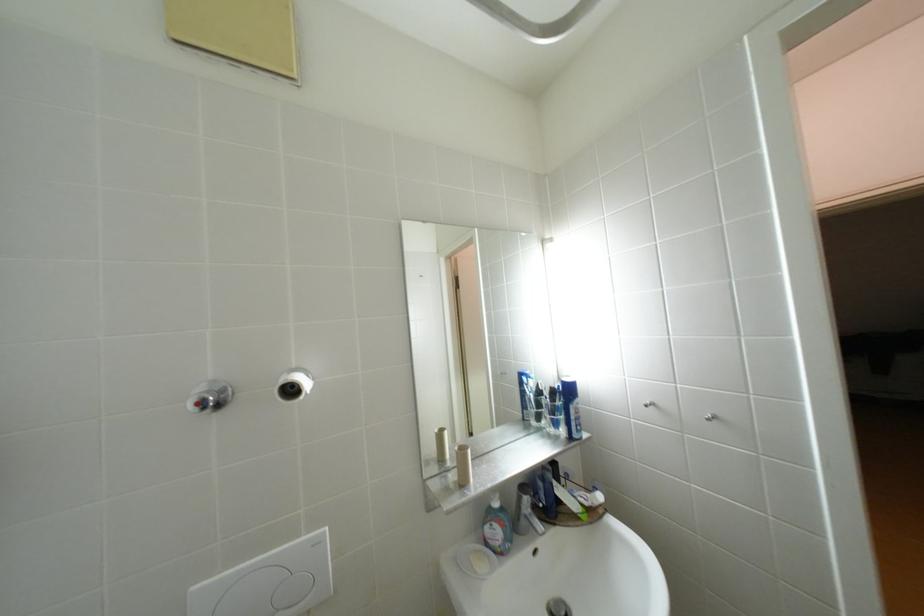
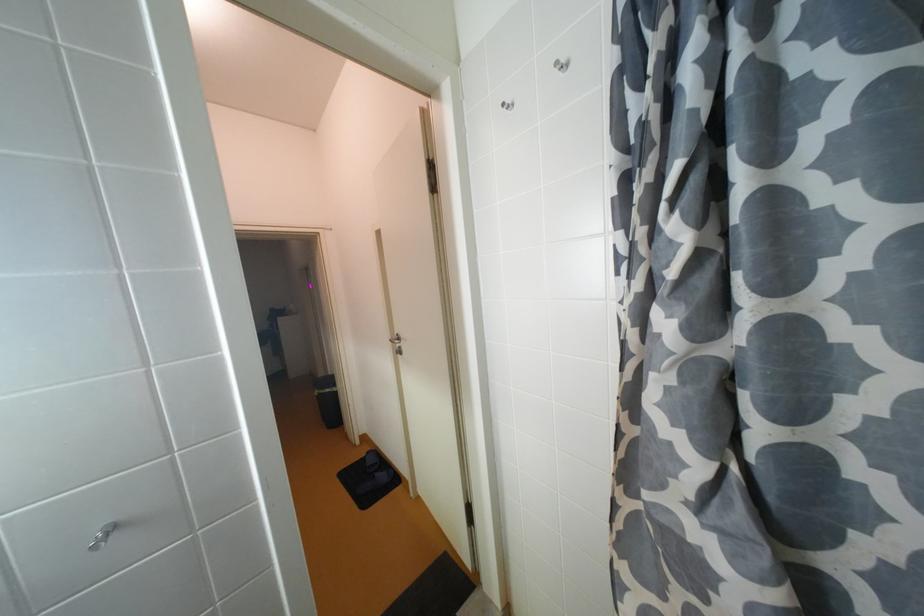
Question: The images are taken continuously from a first-person perspective. In which direction is your viewpoint rotating?

Choices:
 (A) Left
 (B) Right
 (C) Up
 (D) Down

Answer: (B)